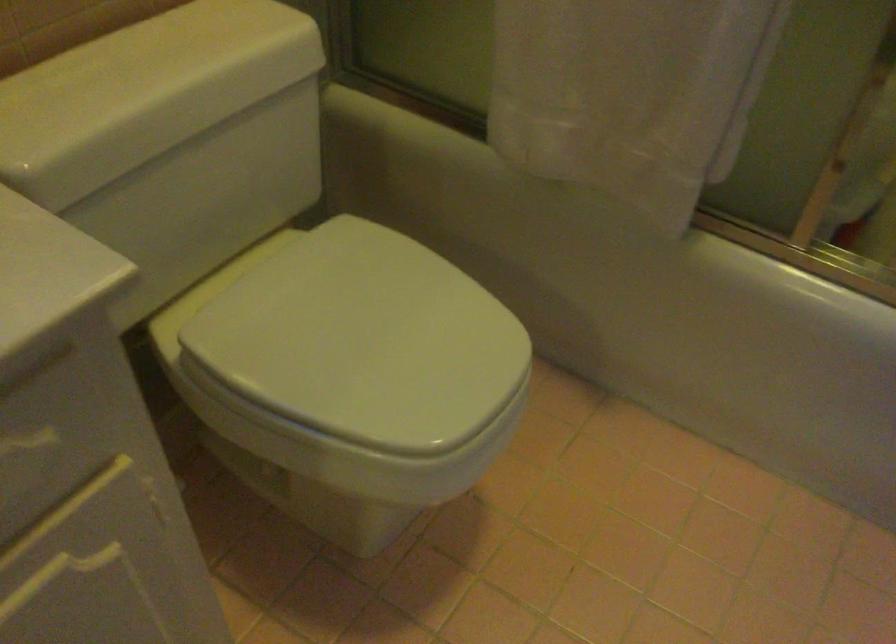
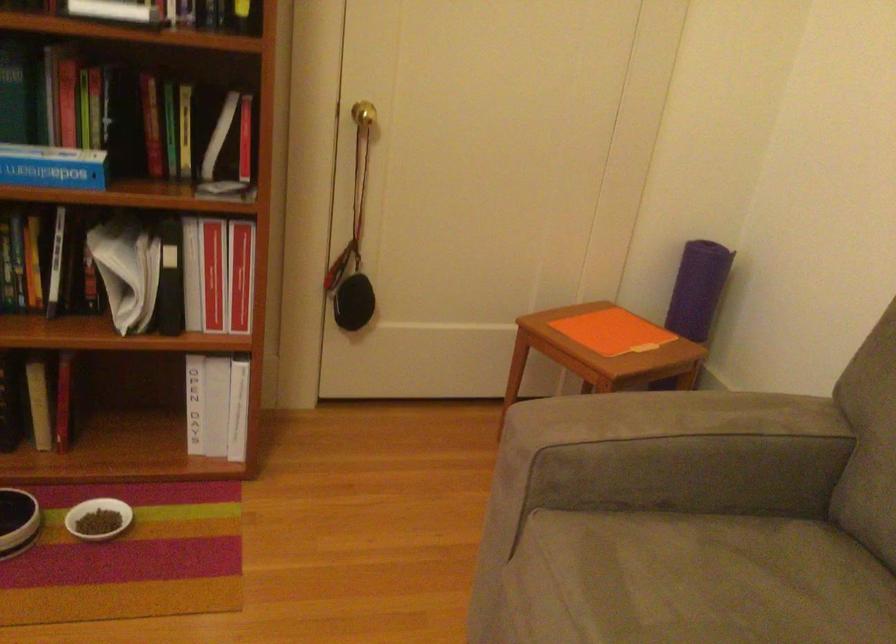
Question: I am providing you with two images of the same scene from different viewpoints. Which of the following objects are not visible in image2?

Choices:
 (A) white toilet lid
 (B) red binder
 (C) patterned white box
 (D) brass door knob

Answer: (A)